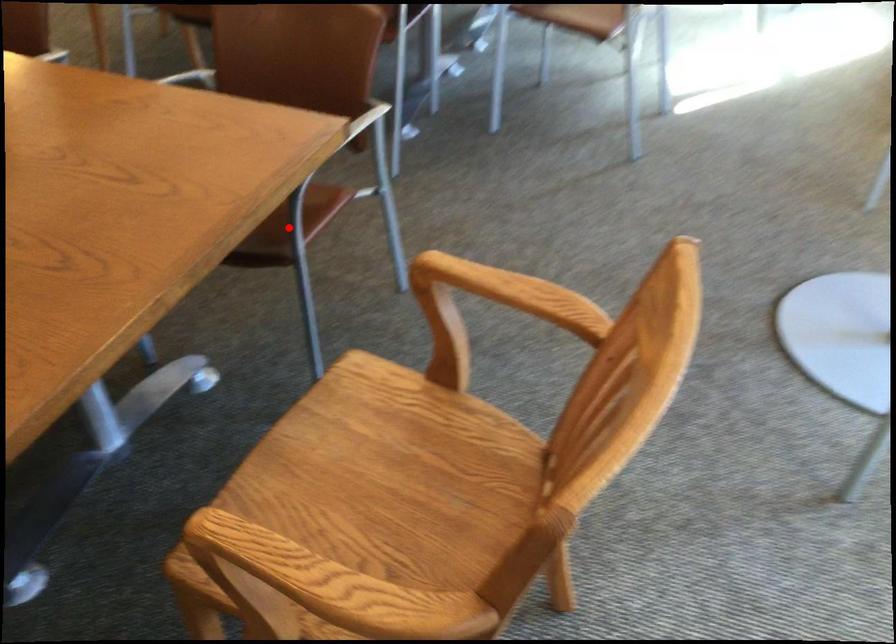
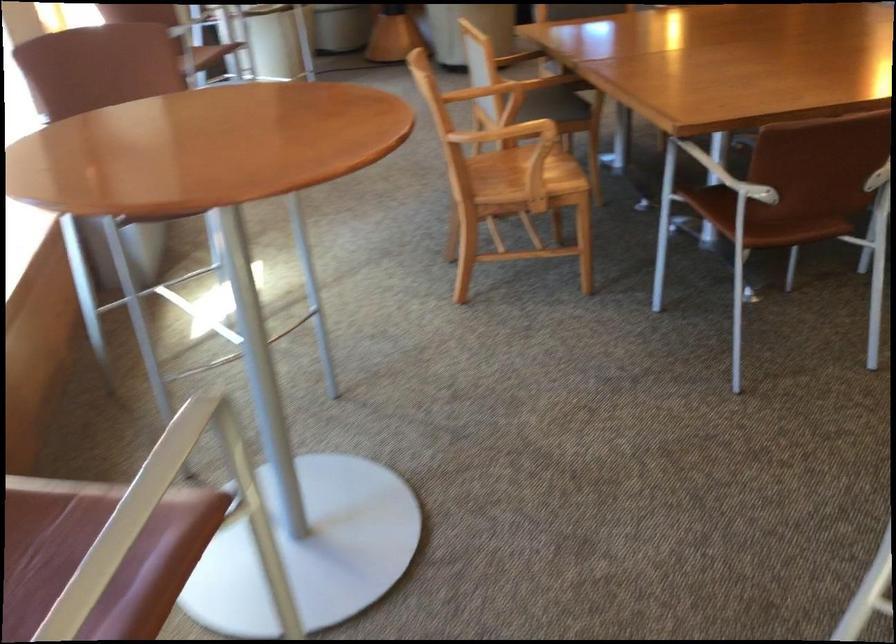
Question: I am providing you with two images of the same scene from different viewpoints. A red point is marked on the first image. At the location where the point appears in image 1, is it still visible in image 2?

Choices:
 (A) Yes
 (B) No

Answer: (B)